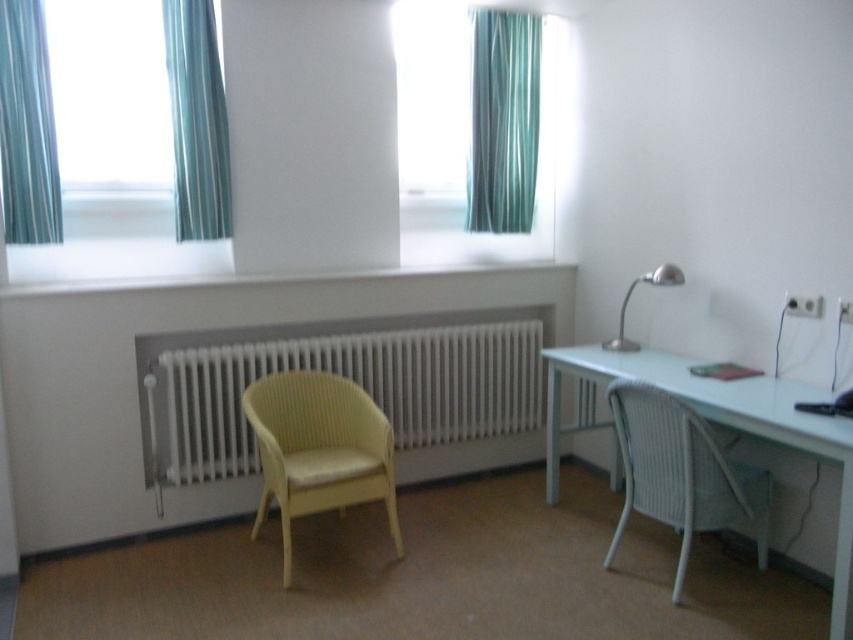
Question: Which of the following is the farthest from the observer?

Choices:
 (A) white metallic radiator at lower center
 (B) green fabric curtain at upper left
 (C) glassy teal curtains at upper center

Answer: (A)

Question: Which object appears farthest from the camera in this image?

Choices:
 (A) blue striped curtain at upper left
 (B) satin silver desk lamp at right

Answer: (B)

Question: Which of the following is the farthest from the observer?

Choices:
 (A) [x=292, y=193]
 (B) [x=485, y=132]
 (C) [x=461, y=394]

Answer: (B)

Question: Can you confirm if glassy teal curtains at upper center is smaller than white metallic radiator at lower center?

Choices:
 (A) no
 (B) yes

Answer: (A)

Question: Does blue striped curtain at upper left come in front of satin silver desk lamp at right?

Choices:
 (A) no
 (B) yes

Answer: (B)

Question: Can you confirm if teal fabric curtain at upper center is wider than satin silver desk lamp at right?

Choices:
 (A) yes
 (B) no

Answer: (A)